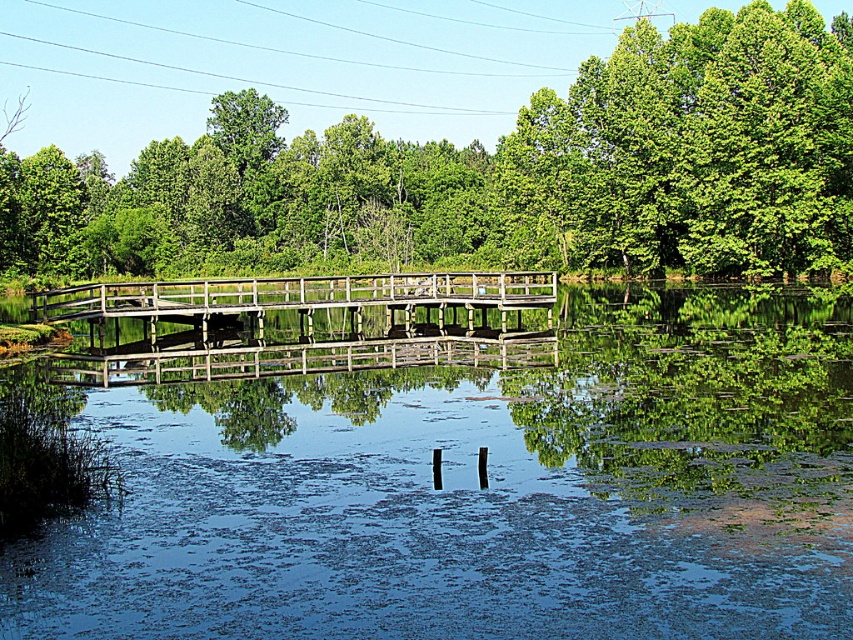
Does clear water at center have a lesser width compared to wooden bridge at center?

Incorrect, clear water at center's width is not less than wooden bridge at center's.

Can you confirm if clear water at center is positioned to the right of wooden bridge at center?

Indeed, clear water at center is positioned on the right side of wooden bridge at center.

Who is more forward, (735, 506) or (308, 332)?

Positioned in front is point (735, 506).

Where is `clear water at center`? This screenshot has width=853, height=640. clear water at center is located at coordinates (482, 490).

Is point (737, 634) more distant than point (332, 180)?

No.

Who is more forward, (612, 525) or (224, 225)?

Point (612, 525)

The width and height of the screenshot is (853, 640). Find the location of `clear water at center`. clear water at center is located at coordinates (482, 490).

Does green leafy tree at center have a smaller size compared to wooden bridge at center?

No.

Between point (399, 236) and point (469, 284), which one is positioned in front?

Positioned in front is point (469, 284).

Locate an element on the screen. The width and height of the screenshot is (853, 640). green leafy tree at center is located at coordinates (479, 168).